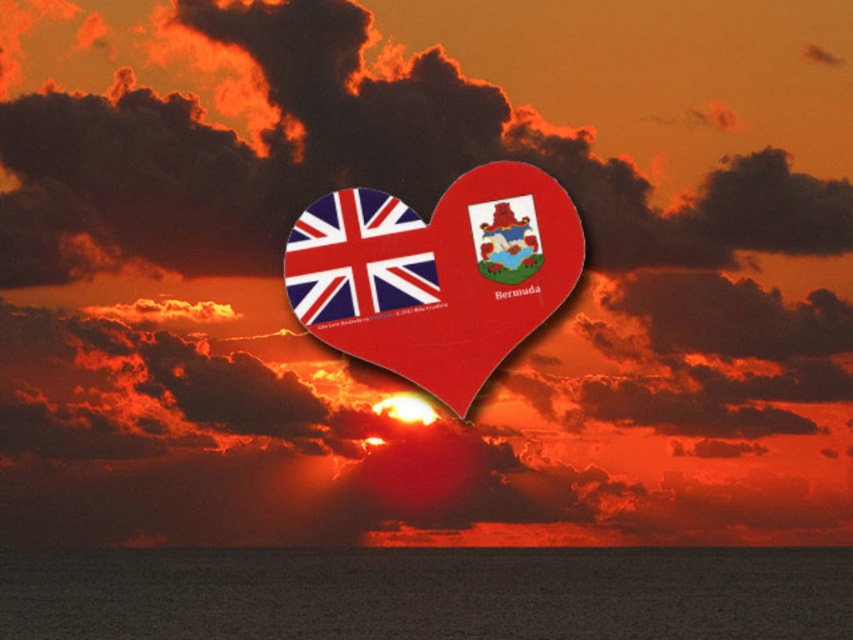
Does smooth water at bottom have a lesser width compared to matte fabric flag at center?

Incorrect, smooth water at bottom's width is not less than matte fabric flag at center's.

Is smooth water at bottom taller than matte fabric flag at center?

Yes, smooth water at bottom is taller than matte fabric flag at center.

This screenshot has height=640, width=853. I want to click on smooth water at bottom, so pos(428,593).

This screenshot has width=853, height=640. I want to click on smooth water at bottom, so click(x=428, y=593).

Looking at this image, which is more to the right, matte plastic heart at center or matte fabric flag at center?

From the viewer's perspective, matte plastic heart at center appears more on the right side.

Which is more to the left, matte plastic heart at center or matte fabric flag at center?

From the viewer's perspective, matte fabric flag at center appears more on the left side.

At what (x,y) coordinates should I click in order to perform the action: click on matte plastic heart at center. Please return your answer as a coordinate pair (x, y). This screenshot has height=640, width=853. Looking at the image, I should click on (436, 275).

From the picture: Between smooth water at bottom and matte plastic heart at center, which one is positioned higher?

matte plastic heart at center is above.

Who is positioned more to the right, smooth water at bottom or matte plastic heart at center?

Positioned to the right is matte plastic heart at center.

Image resolution: width=853 pixels, height=640 pixels. What do you see at coordinates (428, 593) in the screenshot?
I see `smooth water at bottom` at bounding box center [428, 593].

Find the location of a particular element. This screenshot has height=640, width=853. smooth water at bottom is located at coordinates (428, 593).